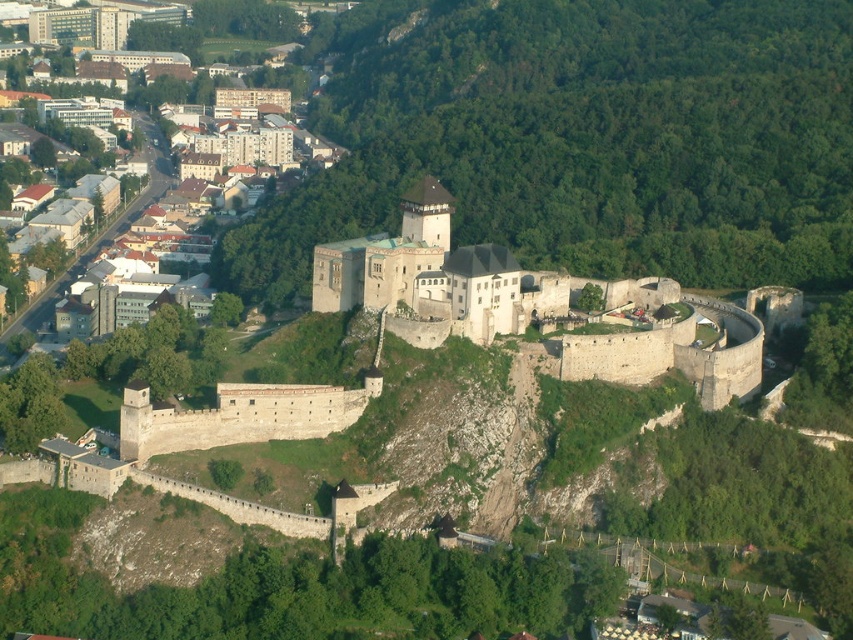
From the picture: You are an architect planning to build a new structure between the stone wall at center and the light brown wooden houses at lower left. Given their widths, which one should you place closer to the castle to maintain balance?

The stone wall at center has a smaller width compared to the light brown wooden houses at lower left. To maintain balance, place the wider light brown wooden houses at lower left closer to the castle so their greater width counterbalances the narrower stone wall at center.

You are an architect analyzing the castle layout. Based on the scene, which object is positioned lower in the image between the stone wall at center and the light brown wooden houses at lower left?

The stone wall at center is positioned lower in the image than the light brown wooden houses at lower left according to the description.

You are an architect analyzing the castle and its surroundings. Based on the scene, which structure has a greater height between the stone wall at center and the light brown wooden houses at lower left?

The light brown wooden houses at lower left have a greater height than the stone wall at center.